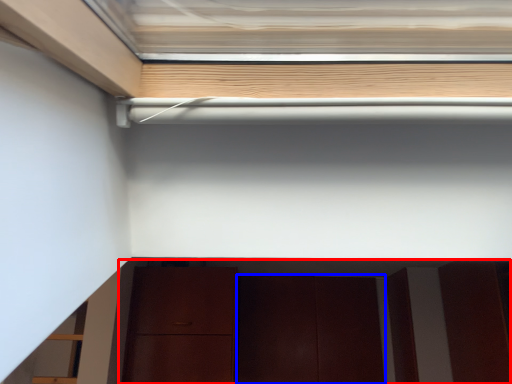
Question: Which of the following is the farthest to the observer, cabinetry (highlighted by a red box) or door (highlighted by a blue box)?

Choices:
 (A) cabinetry
 (B) door

Answer: (B)